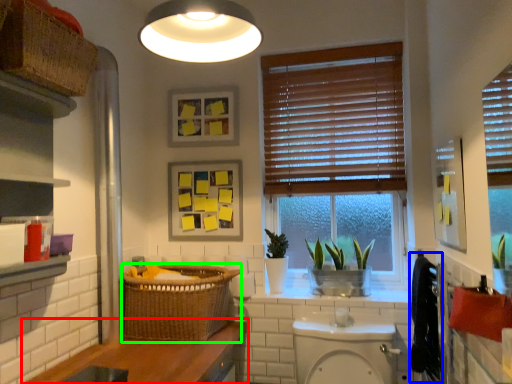
Question: Based on their relative distances, which object is farther from counter top (highlighted by a red box)? Choose from laundry (highlighted by a blue box) and basket (highlighted by a green box).

Choices:
 (A) laundry
 (B) basket

Answer: (A)